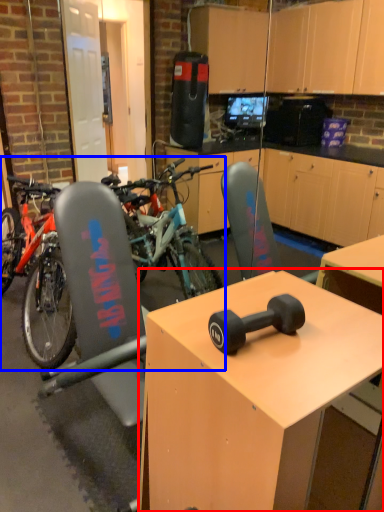
Question: Which object is closer to the camera taking this photo, desk (highlighted by a red box) or mountain bike (highlighted by a blue box)?

Choices:
 (A) desk
 (B) mountain bike

Answer: (A)